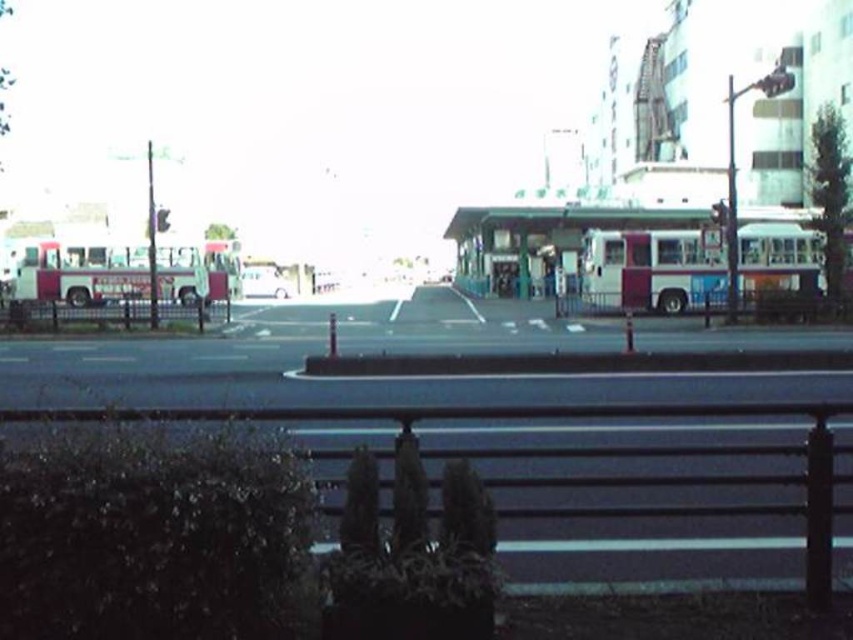
Question: Based on their relative distances, which object is farther from the white glossy car at center?

Choices:
 (A) metallic pole at upper left
 (B) metallic traffic light at upper right
 (C) white glossy fire truck at left
 (D) white matte bus at right

Answer: (B)

Question: Which object is closer to the camera taking this photo?

Choices:
 (A) white glossy car at center
 (B) white matte bus at right

Answer: (B)

Question: Which point is closer to the camera?

Choices:
 (A) metallic pole at upper left
 (B) green plastic bus stop at center

Answer: (A)

Question: Does white matte bus at right have a lesser width compared to green plastic bus stop at center?

Choices:
 (A) yes
 (B) no

Answer: (A)

Question: Observing the image, what is the correct spatial positioning of green plastic bus stop at center in reference to white glossy car at center?

Choices:
 (A) above
 (B) below

Answer: (A)

Question: Is metallic traffic light at upper right thinner than metallic pole at upper left?

Choices:
 (A) yes
 (B) no

Answer: (B)